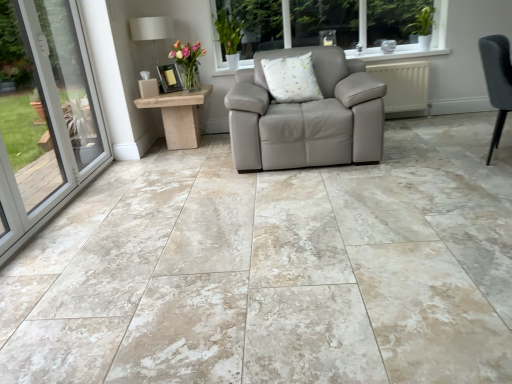
The image size is (512, 384). What do you see at coordinates (179, 116) in the screenshot?
I see `wooden side table at left` at bounding box center [179, 116].

This screenshot has width=512, height=384. Describe the element at coordinates (151, 28) in the screenshot. I see `white fabric lampshade at upper left` at that location.

At what (x,y) coordinates should I click in order to perform the action: click on white fabric lampshade at upper left. Please return your answer as a coordinate pair (x, y). This screenshot has width=512, height=384. Looking at the image, I should click on (151, 28).

Identify the location of dark gray fabric chair at right. This screenshot has height=384, width=512. [497, 81].

What do you see at coordinates (276, 270) in the screenshot? Image resolution: width=512 pixels, height=384 pixels. I see `beige marble floor at center` at bounding box center [276, 270].

I want to click on wooden side table at left, so click(x=179, y=116).

From the image's perspective, which one is positioned lower, matte black picture frame at center or wooden side table at left?

wooden side table at left appears lower in the image.

Does matte black picture frame at center contain wooden side table at left?

Definitely not — wooden side table at left is not inside matte black picture frame at center.

From a real-world perspective, which is physically above, matte black picture frame at center or wooden side table at left?

matte black picture frame at center.

Identify the location of table on the right of matte black picture frame at center. The height and width of the screenshot is (384, 512). (x=179, y=116).

In the scene shown: Can you tell me how much matte black picture frame at center and beige marble floor at center differ in facing direction?

matte black picture frame at center and beige marble floor at center are facing 122 degrees away from each other.

Locate an element on the screen. concrete on the right of matte black picture frame at center is located at coordinates (276, 270).

Which point is more forward, (174, 79) or (313, 258)?

Point (313, 258)

Which object is closer to the camera taking this photo, matte black picture frame at center or beige marble floor at center?

Positioned in front is beige marble floor at center.

Can you confirm if translucent glass vase at upper center is positioned to the left of dark gray fabric chair at right?

Correct, you'll find translucent glass vase at upper center to the left of dark gray fabric chair at right.

Is point (191, 82) closer or farther from the camera than point (505, 87)?

Point (191, 82) is positioned farther from the camera compared to point (505, 87).

Which of these two, translucent glass vase at upper center or dark gray fabric chair at right, is wider?

With larger width is translucent glass vase at upper center.

Identify the location of concrete below the dark gray fabric chair at right (from the image's perspective). (276, 270).

Is dark gray fabric chair at right looking in the opposite direction of beige marble floor at center?

No, beige marble floor at center is not at the back of dark gray fabric chair at right.

Is dark gray fabric chair at right bigger or smaller than beige marble floor at center?

dark gray fabric chair at right is smaller than beige marble floor at center.

Can you see matte black picture frame at center touching translucent glass vase at upper center?

No.

Which object is positioned more to the right, matte black picture frame at center or translucent glass vase at upper center?

translucent glass vase at upper center is more to the right.

From their relative heights in the image, would you say matte black picture frame at center is taller or shorter than translucent glass vase at upper center?

Considering their sizes, matte black picture frame at center has less height than translucent glass vase at upper center.

Which is farther, [176,74] or [193,88]?

The point [176,74] is behind.

Based on their sizes in the image, would you say translucent glass vase at upper center is bigger or smaller than wooden side table at left?

Considering their sizes, translucent glass vase at upper center takes up less space than wooden side table at left.

Would you consider translucent glass vase at upper center to be distant from wooden side table at left?

No, translucent glass vase at upper center is not far away from wooden side table at left.

In order to click on table on the left of translucent glass vase at upper center in this screenshot , I will do `click(179, 116)`.

Can you confirm if translucent glass vase at upper center is positioned to the left of wooden side table at left?

Incorrect, translucent glass vase at upper center is not on the left side of wooden side table at left.

Considering the sizes of wooden side table at left and white fabric lampshade at upper left in the image, is wooden side table at left wider or thinner than white fabric lampshade at upper left?

Clearly, wooden side table at left has more width compared to white fabric lampshade at upper left.

Is wooden side table at left aimed at white fabric lampshade at upper left?

No.

Is wooden side table at left to the left of white fabric lampshade at upper left from the viewer's perspective?

No, wooden side table at left is not to the left of white fabric lampshade at upper left.

From a real-world perspective, between wooden side table at left and white fabric lampshade at upper left, who is vertically higher?

In real-world perspective, white fabric lampshade at upper left is above.

Where is `picture frame above the wooden side table at left (from a real-world perspective)`? The image size is (512, 384). picture frame above the wooden side table at left (from a real-world perspective) is located at coordinates (169, 78).

This screenshot has height=384, width=512. What are the coordinates of `picture frame that appears on the left of beige marble floor at center` in the screenshot? It's located at (169, 78).

Based on their spatial positions, is white fabric lampshade at upper left or wooden side table at left further from translucent glass vase at upper center?

white fabric lampshade at upper left is positioned further to the anchor translucent glass vase at upper center.

Considering their positions, is beige marble floor at center positioned further to matte black picture frame at center than white fabric lampshade at upper left?

beige marble floor at center is positioned further to the anchor matte black picture frame at center.

Which object lies further to the anchor point translucent glass vase at upper center, white fabric lampshade at upper left or dark gray fabric chair at right?

dark gray fabric chair at right is positioned further to the anchor translucent glass vase at upper center.

When comparing their distances from beige marble floor at center, does translucent glass vase at upper center or dark gray fabric chair at right seem further?

The object further to beige marble floor at center is translucent glass vase at upper center.

Considering their positions, is beige marble floor at center positioned closer to matte black picture frame at center than dark gray fabric chair at right?

Based on the image, beige marble floor at center appears to be nearer to matte black picture frame at center.

Considering their positions, is white fabric lampshade at upper left positioned closer to beige marble floor at center than wooden side table at left?

wooden side table at left is closer to beige marble floor at center.

Based on their spatial positions, is dark gray fabric chair at right or matte black picture frame at center closer to white fabric lampshade at upper left?

Among the two, matte black picture frame at center is located nearer to white fabric lampshade at upper left.

When comparing their distances from white fabric lampshade at upper left, does wooden side table at left or translucent glass vase at upper center seem closer?

translucent glass vase at upper center.

Locate an element on the screen. This screenshot has height=384, width=512. concrete located between white fabric lampshade at upper left and dark gray fabric chair at right in the left-right direction is located at coordinates (276, 270).

Identify the location of flower positioned between beige marble floor at center and white fabric lampshade at upper left from near to far. (188, 63).

In order to click on lamp positioned between beige marble floor at center and matte black picture frame at center from near to far in this screenshot , I will do [151, 28].

Where is `picture frame located between white fabric lampshade at upper left and translucent glass vase at upper center in the left-right direction`? The width and height of the screenshot is (512, 384). picture frame located between white fabric lampshade at upper left and translucent glass vase at upper center in the left-right direction is located at coordinates (169, 78).